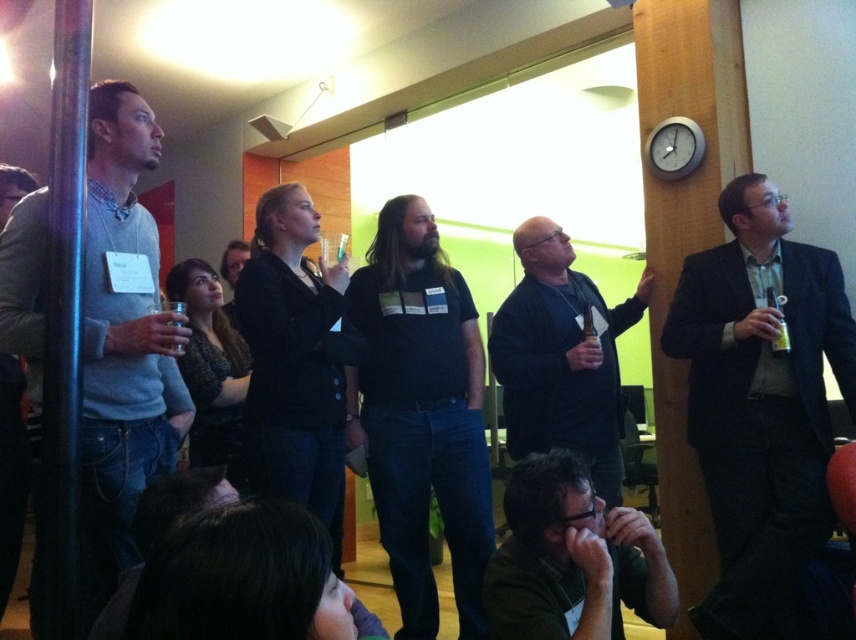
Question: Can you confirm if dark gray sweater at center is positioned above green matte shirt at lower center?

Choices:
 (A) yes
 (B) no

Answer: (A)

Question: Can you confirm if dark suit at right is smaller than dark gray sweater at center?

Choices:
 (A) no
 (B) yes

Answer: (B)

Question: Is matte gray sweater at left to the right of dark gray sweater at center from the viewer's perspective?

Choices:
 (A) no
 (B) yes

Answer: (A)

Question: Which of the following is the closest to the observer?

Choices:
 (A) dark suit at right
 (B) dark gray sweater at center
 (C) matte gray sweater at left
 (D) green matte shirt at lower center

Answer: (C)

Question: Among these points, which one is nearest to the camera?

Choices:
 (A) (125, 321)
 (B) (617, 394)
 (C) (530, 557)
 (D) (825, 493)

Answer: (C)

Question: Based on their relative distances, which object is nearer to the dark suit at right?

Choices:
 (A) matte gray sweater at left
 (B) dark gray sweater at center
 (C) green matte shirt at lower center

Answer: (B)